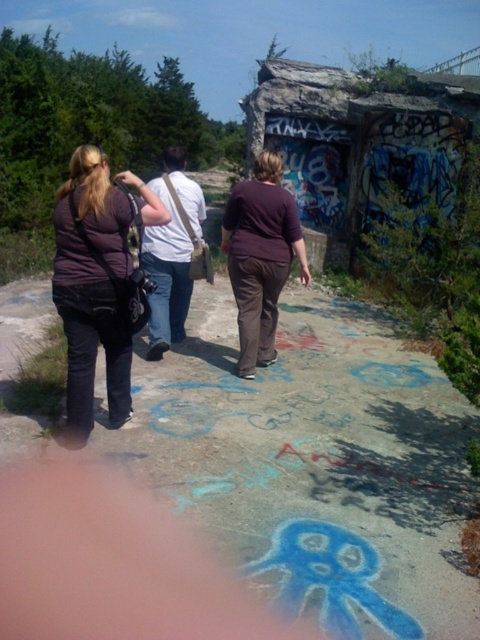
Question: Which object is the closest to the matte purple shirt at center?

Choices:
 (A) white fabric bag at center
 (B) concrete sidewalk at center

Answer: (A)

Question: Is matte purple shirt at center further to camera compared to white fabric bag at center?

Choices:
 (A) no
 (B) yes

Answer: (B)

Question: Can you confirm if concrete sidewalk at center is bigger than matte black pants at center?

Choices:
 (A) yes
 (B) no

Answer: (A)

Question: Considering the real-world distances, which object is farthest from the concrete sidewalk at center?

Choices:
 (A) matte purple shirt at center
 (B) matte black pants at center

Answer: (B)

Question: Which of the following is the farthest from the observer?

Choices:
 (A) (62, 259)
 (B) (155, 340)
 (C) (245, 269)

Answer: (B)

Question: Considering the relative positions of concrete sidewalk at center and white fabric bag at center in the image provided, where is concrete sidewalk at center located with respect to white fabric bag at center?

Choices:
 (A) left
 (B) right

Answer: (B)